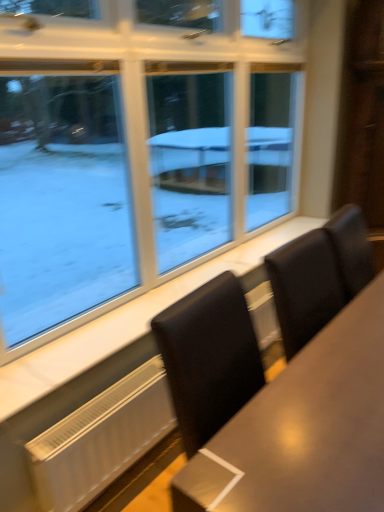
This screenshot has width=384, height=512. Describe the element at coordinates (136, 147) in the screenshot. I see `clear glass window at upper left` at that location.

This screenshot has width=384, height=512. I want to click on matte brown table at center, so click(304, 429).

From a real-world perspective, which is physically below, clear glass window at upper left or matte brown table at center?

In real-world perspective, matte brown table at center is lower.

Based on their sizes in the image, would you say clear glass window at upper left is bigger or smaller than matte brown table at center?

Clearly, clear glass window at upper left is smaller in size than matte brown table at center.

Which point is more forward, (90, 13) or (343, 411)?

Positioned in front is point (343, 411).

Considering the relative sizes of clear glass window at upper left and matte brown table at center in the image provided, is clear glass window at upper left shorter than matte brown table at center?

Incorrect, the height of clear glass window at upper left does not fall short of that of matte brown table at center.

Which object is further away from the camera taking this photo, matte brown table at center or clear glass window at upper left?

clear glass window at upper left is behind.

Can you confirm if matte brown table at center is positioned to the right of clear glass window at upper left?

Correct, you'll find matte brown table at center to the right of clear glass window at upper left.

Does matte brown table at center have a lesser width compared to clear glass window at upper left?

Incorrect, the width of matte brown table at center is not less than that of clear glass window at upper left.

Is white matte radiator at lower left shorter than white marble window sill at lower center?

No.

Is there a large distance between white matte radiator at lower left and white marble window sill at lower center?

No, white matte radiator at lower left is not far away from white marble window sill at lower center.

Which is less distant, (x=56, y=431) or (x=194, y=282)?

The point (x=56, y=431) is more forward.

Is white matte radiator at lower left aimed at white marble window sill at lower center?

No, white matte radiator at lower left does not turn towards white marble window sill at lower center.

Between matte brown table at center and white matte radiator at lower left, which one has smaller size?

white matte radiator at lower left is smaller.

Looking at their sizes, would you say matte brown table at center is wider or thinner than white matte radiator at lower left?

matte brown table at center is wider than white matte radiator at lower left.

From the image's perspective, is matte brown table at center on white matte radiator at lower left?

Yes, from the image's perspective, matte brown table at center is on top of white matte radiator at lower left.

From the image's perspective, which object appears higher, clear glass window at upper left or white marble window sill at lower center?

clear glass window at upper left is shown above in the image.

Between clear glass window at upper left and white marble window sill at lower center, which one has less height?

With less height is white marble window sill at lower center.

Which is in front, point (231, 231) or point (151, 311)?

The point (151, 311) is in front.

Which object is further away from the camera, clear glass window at upper left or white matte radiator at lower left?

white matte radiator at lower left is further away from the camera.

Is the surface of clear glass window at upper left in direct contact with white matte radiator at lower left?

clear glass window at upper left and white matte radiator at lower left are not in contact.

Is clear glass window at upper left surrounding white matte radiator at lower left?

No, white matte radiator at lower left is located outside of clear glass window at upper left.

From a real-world perspective, relative to matte brown table at center, is white marble window sill at lower center vertically above or below?

white marble window sill at lower center is situated higher than matte brown table at center in the real world.

In the scene shown: Is white marble window sill at lower center facing away from matte brown table at center?

No, white marble window sill at lower center is not facing away from matte brown table at center.

Does white marble window sill at lower center contain matte brown table at center?

No, matte brown table at center is located outside of white marble window sill at lower center.

At what (x,y) coordinates should I click in order to perform the action: click on table on the right side of white marble window sill at lower center. Please return your answer as a coordinate pair (x, y). Image resolution: width=384 pixels, height=512 pixels. Looking at the image, I should click on (304, 429).

Locate an element on the screen. The image size is (384, 512). table below the clear glass window at upper left (from a real-world perspective) is located at coordinates (304, 429).

Where is `table below the clear glass window at upper left (from the image's perspective)`? table below the clear glass window at upper left (from the image's perspective) is located at coordinates (304, 429).

Based on their spatial positions, is white matte radiator at lower left or clear glass window at upper left closer to matte brown table at center?

The object closer to matte brown table at center is white matte radiator at lower left.

Estimate the real-world distances between objects in this image. Which object is further from clear glass window at upper left, white marble window sill at lower center or white matte radiator at lower left?

The object further to clear glass window at upper left is white matte radiator at lower left.

Which object lies further to the anchor point clear glass window at upper left, white matte radiator at lower left or matte brown table at center?

matte brown table at center is further to clear glass window at upper left.

Considering their positions, is clear glass window at upper left positioned closer to white matte radiator at lower left than white marble window sill at lower center?

white marble window sill at lower center.

Estimate the real-world distances between objects in this image. Which object is further from clear glass window at upper left, white matte radiator at lower left or white marble window sill at lower center?

white matte radiator at lower left is positioned further to the anchor clear glass window at upper left.

Estimate the real-world distances between objects in this image. Which object is closer to white marble window sill at lower center, white matte radiator at lower left or clear glass window at upper left?

Based on the image, white matte radiator at lower left appears to be nearer to white marble window sill at lower center.

Estimate the real-world distances between objects in this image. Which object is further from matte brown table at center, white marble window sill at lower center or clear glass window at upper left?

Based on the image, clear glass window at upper left appears to be further to matte brown table at center.

Looking at the image, which one is located further to white marble window sill at lower center, white matte radiator at lower left or matte brown table at center?

matte brown table at center.

At what (x,y) coordinates should I click in order to perform the action: click on window sill between clear glass window at upper left and matte brown table at center in the up-down direction. Please return your answer as a coordinate pair (x, y). The width and height of the screenshot is (384, 512). Looking at the image, I should click on (126, 323).

In order to click on window sill between clear glass window at upper left and white matte radiator at lower left in the vertical direction in this screenshot , I will do `click(126, 323)`.

Locate an element on the screen. table between clear glass window at upper left and white matte radiator at lower left from top to bottom is located at coordinates (304, 429).

The image size is (384, 512). In order to click on window sill between white matte radiator at lower left and matte brown table at center in this screenshot , I will do `click(126, 323)`.